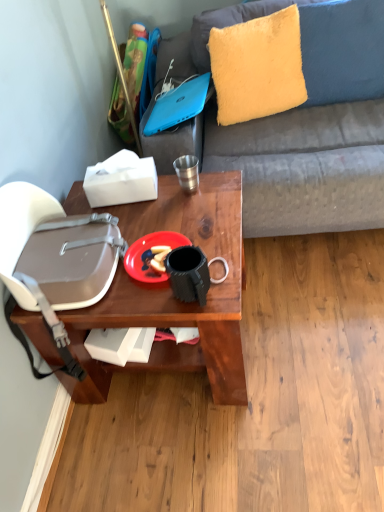
The height and width of the screenshot is (512, 384). Identify the location of vacant position to the left of metallic silver cup at center. (150, 199).